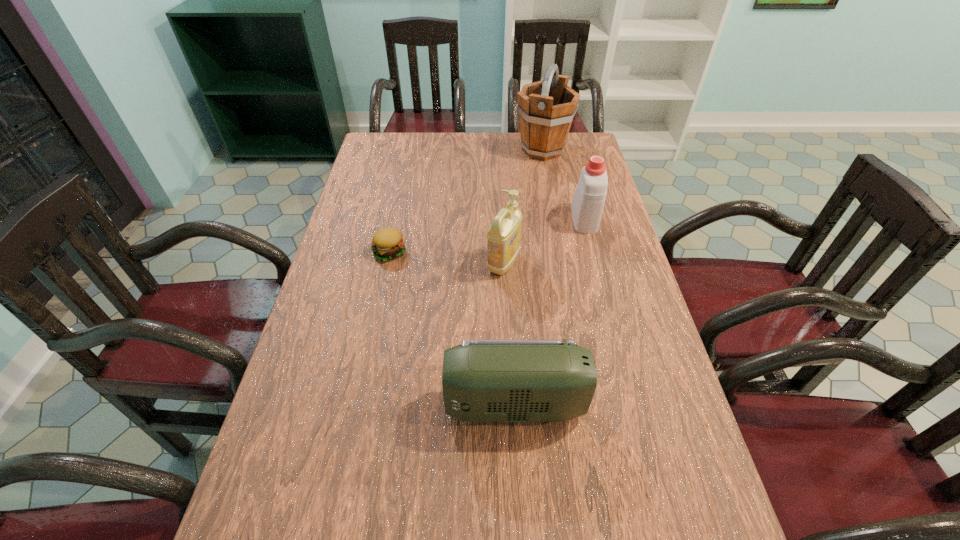
You are a GUI agent. You are given a task and a screenshot of the screen. Output one action in this format:
    pyautogui.click(x=<x>, y=<y>)
    Task: Click on the bucket that is at the right edge
    This screenshot has width=960, height=540.
    Given the screenshot: What is the action you would take?
    pyautogui.click(x=546, y=108)

Locate an element on the screen. The width and height of the screenshot is (960, 540). detergent located at the right edge is located at coordinates (588, 200).

Identify the location of object that is at the far right corner. (546, 108).

Locate an element on the screen. The height and width of the screenshot is (540, 960). vacant space at the far edge of the desktop is located at coordinates click(x=446, y=157).

Identify the location of vacant space at the left edge. This screenshot has height=540, width=960. (360, 194).

This screenshot has width=960, height=540. In the image, there is a desktop. In order to click on vacant space at the right edge in this screenshot , I will do `click(623, 316)`.

Locate an element on the screen. This screenshot has width=960, height=540. vacant space at the far right corner of the desktop is located at coordinates (586, 133).

The width and height of the screenshot is (960, 540). What are the coordinates of `free spot between the radio_receiver and the tallest object` in the screenshot? It's located at (529, 277).

Find the location of a particular element. This screenshot has width=960, height=540. free space that is in between the farthest object and the fourth nearest object is located at coordinates pos(564,184).

I want to click on free space between the farther detergent and the nearest object, so click(549, 312).